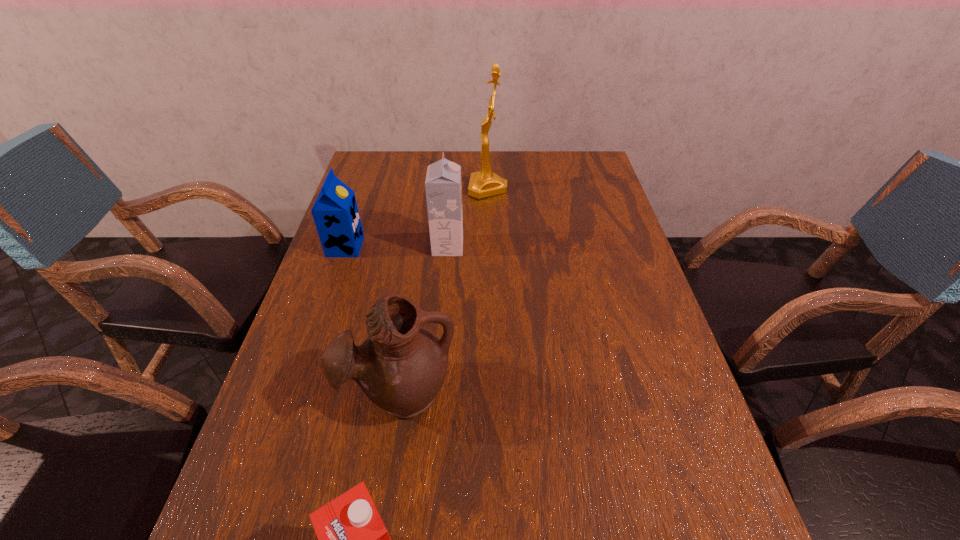
Select which object appears as the second closest to the award. Please provide its 2D coordinates. Your answer should be formatted as a tuple, i.e. [(x, y)], where the tuple contains the x and y coordinates of a point satisfying the conditions above.

[(335, 212)]

I want to click on carton that can be found as the second closest to the tallest carton, so click(352, 539).

Select which carton is the third closest to the farthest object. Please provide its 2D coordinates. Your answer should be formatted as a tuple, i.e. [(x, y)], where the tuple contains the x and y coordinates of a point satisfying the conditions above.

[(352, 539)]

Find the location of `free space that satisfies the following two spatial constraints: 1. on the front label of the tallest carton; 2. at the spout of the pitcher`. free space that satisfies the following two spatial constraints: 1. on the front label of the tallest carton; 2. at the spout of the pitcher is located at coordinates (436, 393).